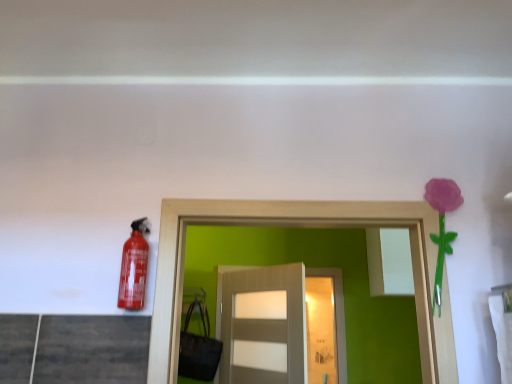
Question: Is matte gray door at center looking in the opposite direction of matte red extinguisher at left?

Choices:
 (A) no
 (B) yes

Answer: (A)

Question: Is the depth of matte gray door at center greater than that of matte red extinguisher at left?

Choices:
 (A) yes
 (B) no

Answer: (A)

Question: Does matte gray door at center have a smaller size compared to matte red extinguisher at left?

Choices:
 (A) no
 (B) yes

Answer: (A)

Question: Can you confirm if matte gray door at center is bigger than matte red extinguisher at left?

Choices:
 (A) no
 (B) yes

Answer: (B)

Question: Can you confirm if matte gray door at center is positioned to the right of matte red extinguisher at left?

Choices:
 (A) yes
 (B) no

Answer: (A)

Question: Does matte gray door at center have a greater height compared to matte red extinguisher at left?

Choices:
 (A) yes
 (B) no

Answer: (A)

Question: From a real-world perspective, is matte red extinguisher at left located beneath purple matte flower at upper right?

Choices:
 (A) yes
 (B) no

Answer: (A)

Question: Can we say matte red extinguisher at left lies outside purple matte flower at upper right?

Choices:
 (A) yes
 (B) no

Answer: (A)

Question: Does matte red extinguisher at left have a larger size compared to purple matte flower at upper right?

Choices:
 (A) yes
 (B) no

Answer: (A)

Question: Is matte red extinguisher at left surrounding purple matte flower at upper right?

Choices:
 (A) no
 (B) yes

Answer: (A)

Question: Is matte red extinguisher at left far away from purple matte flower at upper right?

Choices:
 (A) no
 (B) yes

Answer: (A)

Question: Is matte red extinguisher at left further to camera compared to purple matte flower at upper right?

Choices:
 (A) no
 (B) yes

Answer: (A)

Question: Is purple matte flower at upper right to the left of matte gray door at center from the viewer's perspective?

Choices:
 (A) no
 (B) yes

Answer: (A)